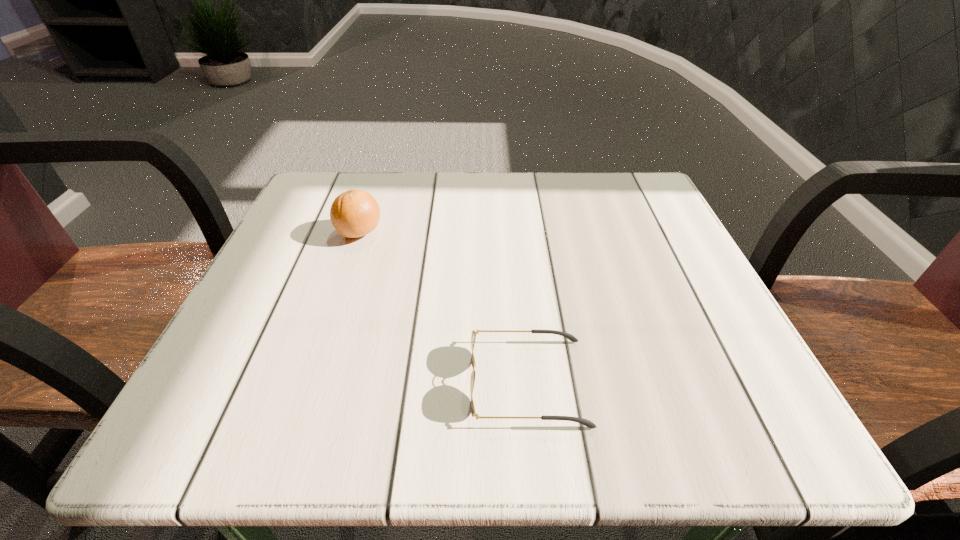
Locate an element on the screen. object that is at the left edge is located at coordinates (354, 213).

Where is `object that is at the far left corner`? This screenshot has width=960, height=540. object that is at the far left corner is located at coordinates (354, 213).

The width and height of the screenshot is (960, 540). I want to click on free space at the far edge, so click(588, 217).

This screenshot has width=960, height=540. In the image, there is a desktop. What are the coordinates of `free space at the near edge` in the screenshot? It's located at (488, 431).

The image size is (960, 540). In the image, there is a desktop. What are the coordinates of `vacant space at the left edge` in the screenshot? It's located at (300, 313).

Locate an element on the screen. free space at the right edge of the desktop is located at coordinates (660, 241).

Identify the location of free space at the far left corner. (326, 201).

The width and height of the screenshot is (960, 540). Identify the location of vacant space at the far right corner of the desktop. (608, 224).

I want to click on vacant space at the near right corner of the desktop, so click(678, 444).